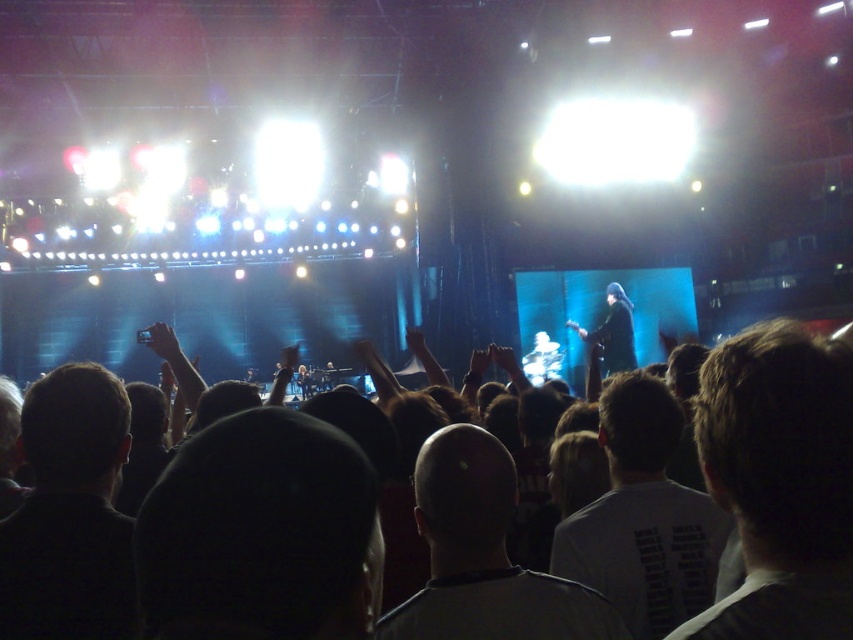
Which is above, dark hair at upper right or dark hair at lower left?

Positioned higher is dark hair at upper right.

Measure the distance between dark hair at upper right and dark hair at lower left.

The distance of dark hair at upper right from dark hair at lower left is 8.99 meters.

Which is behind, point (811, 435) or point (80, 406)?

The point (80, 406) is more distant.

At what (x,y) coordinates should I click in order to perform the action: click on dark hair at upper right. Please return your answer as a coordinate pair (x, y). The image size is (853, 640). Looking at the image, I should click on (779, 481).

Based on the photo, does black fabric at center appear on the right side of dark hair at upper right?

In fact, black fabric at center is to the left of dark hair at upper right.

Which is in front, point (321, 490) or point (819, 580)?

Positioned in front is point (819, 580).

What are the coordinates of `black fabric at center` in the screenshot? It's located at (258, 532).

Looking at this image, who is shorter, white t-shirt at center or bald head at center?

Standing shorter between the two is bald head at center.

Which of these two, white t-shirt at center or bald head at center, stands taller?

white t-shirt at center

Who is more forward, [640,621] or [456,516]?

Positioned in front is point [456,516].

The image size is (853, 640). What are the coordinates of `white t-shirt at center` in the screenshot? It's located at (643, 516).